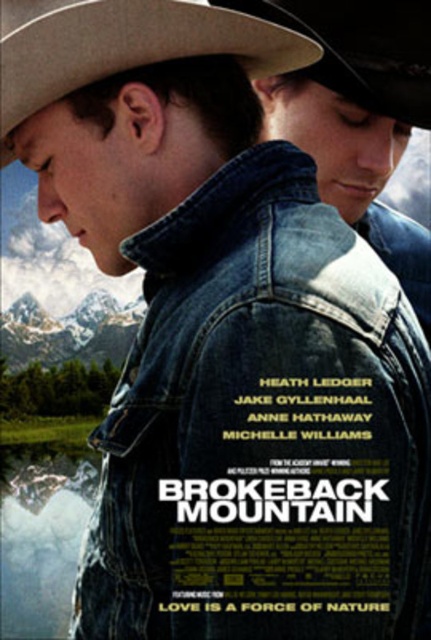
Looking at the movie poster for Brokeback Mountain, you notice the beige felt cowboy hat at upper left and the rustic leather cowboy hat at upper center. Which hat has a greater height?

The beige felt cowboy hat at upper left is much taller than the rustic leather cowboy hat at upper center.

Looking at this image, you are analyzing the movie poster for Brokeback Mountain. There are two points marked on the poster at coordinates point [256,440] and point [339,26]. Which of these points is positioned closer to the viewer?

Point [256,440] is closer to the viewer than point [339,26].